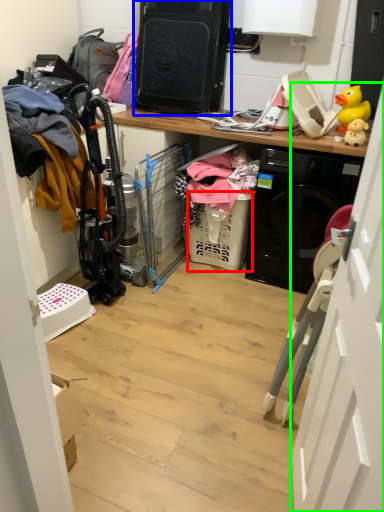
Question: Which object is positioned farthest from basket (highlighted by a red box)? Select from appliance (highlighted by a blue box) and door (highlighted by a green box).

Choices:
 (A) appliance
 (B) door

Answer: (B)